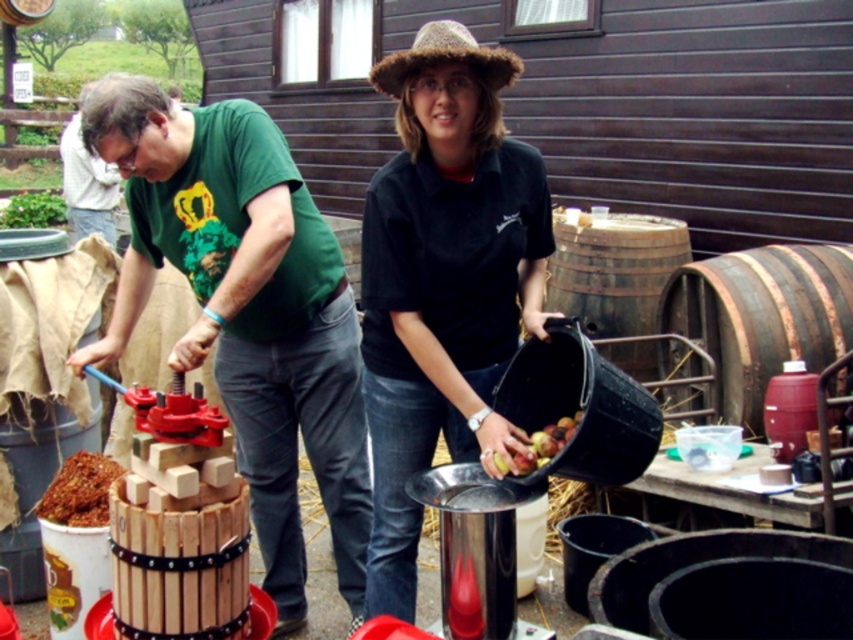
You are standing at the position of the camera. You want to move to the brown wooden barrel at right to check its contents. Is the distance between you and the barrel sufficient to allow you to walk there without needing to move any objects in the way?

The distance between you and the brown wooden barrel at right is 3.79 meters, so yes, the distance is sufficient to walk there without needing to move any objects in the way.

What object is located at the coordinates point [253,324]?

The wooden barrel at center is located at point [253,324].